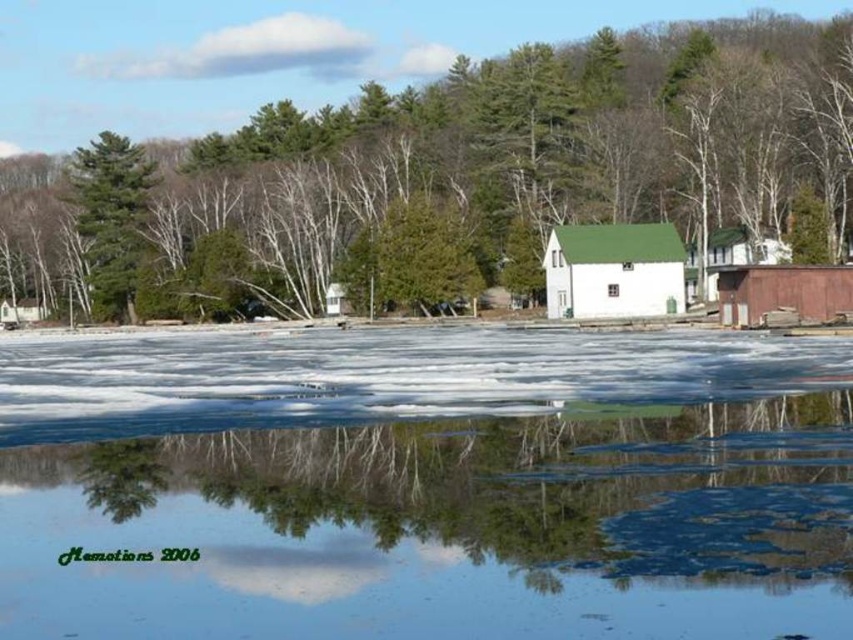
Question: Does white matte barn at center come in front of green textured pine tree at left?

Choices:
 (A) yes
 (B) no

Answer: (A)

Question: Which of the following is the closest to the observer?

Choices:
 (A) white wood barn at center
 (B) translucent ice at center

Answer: (B)

Question: Can you confirm if translucent ice at center is bigger than white wood barn at center?

Choices:
 (A) no
 (B) yes

Answer: (B)

Question: Based on their relative distances, which object is farther from the white wood barn at center?

Choices:
 (A) green leafy tree at center
 (B) white matte barn at center
 (C) translucent ice at center
 (D) green textured pine tree at left

Answer: (D)

Question: Which object appears farthest from the camera in this image?

Choices:
 (A) white matte barn at center
 (B) white wood barn at center

Answer: (A)

Question: Does translucent ice at center appear under white wood barn at center?

Choices:
 (A) yes
 (B) no

Answer: (A)